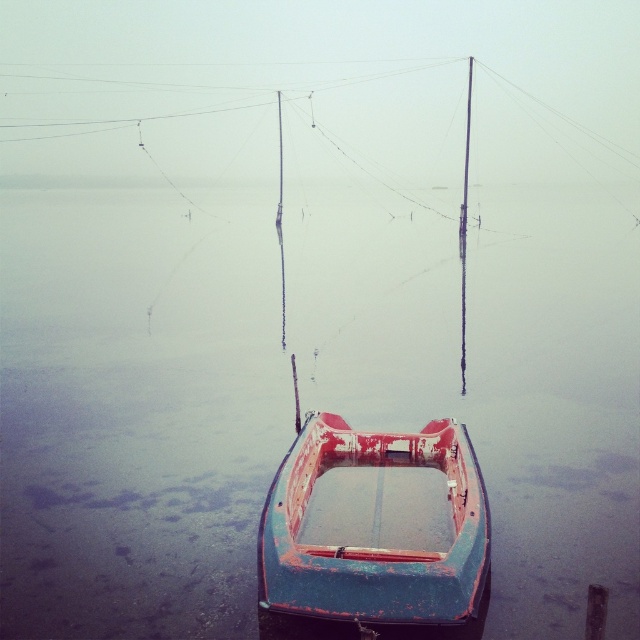
You are a photographer trying to capture the rusty metal boat at center and the rusty metal water at center in the same frame. Based on their positions, which object should you adjust your camera to focus on first to ensure both are in the shot?

Since the rusty metal water at center is to the left of the rusty metal boat at center, you should focus on the rusty metal boat at center first as it is positioned further to the right, allowing the camera to capture both objects by adjusting from right to left.

You are standing on the boat and looking at two points in the scene. The first point is at coordinates point (64, 486) and the second is at point (420, 577). Which point is closer to you?

Point (64, 486) is closer to you because it is further to the camera than point (420, 577).